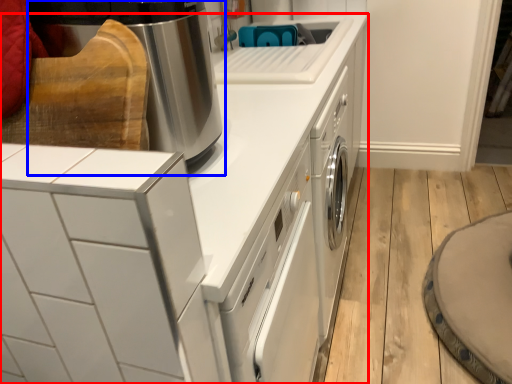
Question: Which object is further to the camera taking this photo, home appliance (highlighted by a red box) or home appliance (highlighted by a blue box)?

Choices:
 (A) home appliance
 (B) home appliance

Answer: (B)